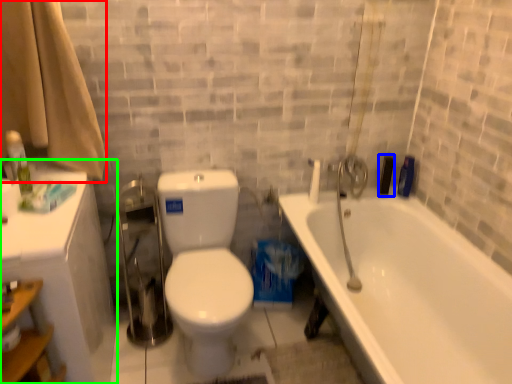
Question: Estimate the real-world distances between objects in this image. Which object is farther from shower curtain (highlighted by a red box), toiletry (highlighted by a blue box) or medicine cabinet (highlighted by a green box)?

Choices:
 (A) toiletry
 (B) medicine cabinet

Answer: (A)